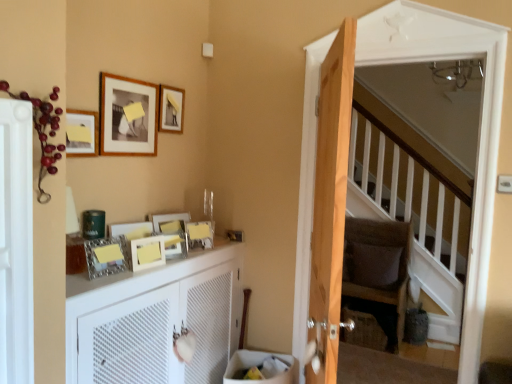
You are a GUI agent. You are given a task and a screenshot of the screen. Output one action in this format:
    pyautogui.click(x=<x>, y=<y>)
    Task: Click on the vacant region in front of matte silver picture frame at center, the 2th picture frame in the bottom-to-top sequence
    
    Given the screenshot: What is the action you would take?
    pyautogui.click(x=97, y=278)